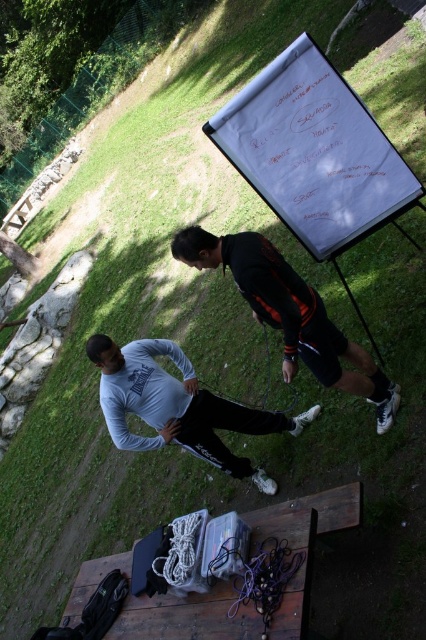
In the scene shown: Can you confirm if wooden picnic table at lower center is positioned to the left of black matte jacket at center?

Correct, you'll find wooden picnic table at lower center to the left of black matte jacket at center.

Is wooden picnic table at lower center thinner than black matte jacket at center?

Incorrect, wooden picnic table at lower center's width is not less than black matte jacket at center's.

Between point (308, 611) and point (252, 241), which one is positioned behind?

The point (252, 241) is behind.

The height and width of the screenshot is (640, 426). In order to click on wooden picnic table at lower center in this screenshot , I will do `click(304, 544)`.

Is wooden picnic table at lower center smaller than white matte shirt at lower left?

No.

Can you confirm if wooden picnic table at lower center is wider than white matte shirt at lower left?

Yes.

Does point (178, 627) come closer to viewer compared to point (106, 376)?

Yes, point (178, 627) is closer to viewer.

The width and height of the screenshot is (426, 640). In order to click on wooden picnic table at lower center in this screenshot , I will do `click(304, 544)`.

Does white matte shirt at lower left have a smaller size compared to black matte jacket at center?

Yes.

Who is more forward, (140, 440) or (385, 376)?

Point (385, 376) is more forward.

Where is `white matte shirt at lower left`? Image resolution: width=426 pixels, height=640 pixels. white matte shirt at lower left is located at coordinates (178, 406).